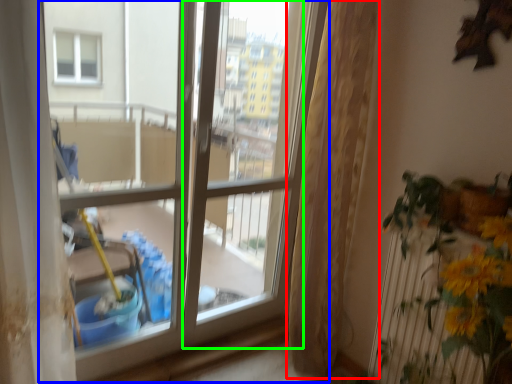
Question: Which object is the farthest from curtain (highlighted by a red box)? Choose among these: window (highlighted by a blue box) or screen door (highlighted by a green box).

Choices:
 (A) window
 (B) screen door

Answer: (B)